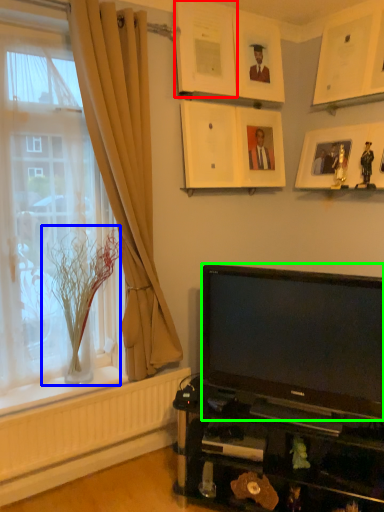
Question: Estimate the real-world distances between objects in this image. Which object is farther from picture frame (highlighted by a red box), glass vase (highlighted by a blue box) or television (highlighted by a green box)?

Choices:
 (A) glass vase
 (B) television

Answer: (B)